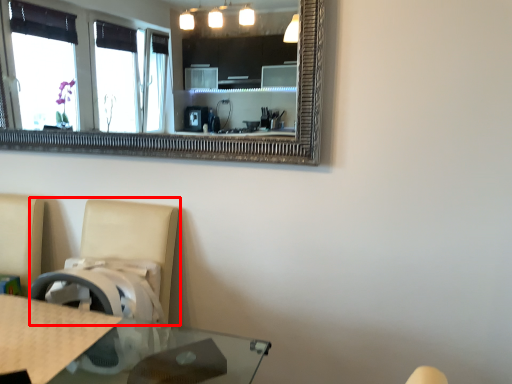
Question: From the image's perspective, what is the correct spatial relationship of swivel chair (annotated by the red box) in relation to counter top?

Choices:
 (A) above
 (B) below

Answer: (B)